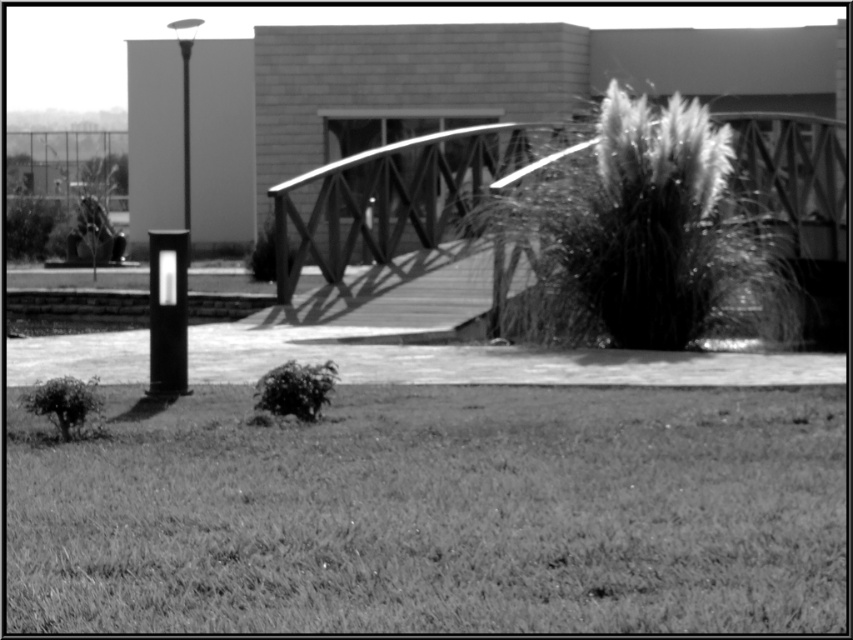
Question: Does wooden bridge at center come behind smooth black post at left?

Choices:
 (A) no
 (B) yes

Answer: (B)

Question: Which object is the farthest from the grassy lawn at lower center?

Choices:
 (A) smooth black post at left
 (B) wooden bridge at center
 (C) polished metal lamp post at left

Answer: (C)

Question: Among these objects, which one is farthest from the camera?

Choices:
 (A) wooden bridge at center
 (B) grassy lawn at lower center
 (C) polished metal lamp post at left
 (D) smooth black post at left

Answer: (C)

Question: Estimate the real-world distances between objects in this image. Which object is farther from the wooden bridge at center?

Choices:
 (A) smooth black post at left
 (B) grassy lawn at lower center
 (C) polished metal lamp post at left

Answer: (B)

Question: Observing the image, what is the correct spatial positioning of smooth black post at left in reference to polished metal lamp post at left?

Choices:
 (A) right
 (B) left

Answer: (A)

Question: Can you confirm if grassy lawn at lower center is bigger than wooden bridge at center?

Choices:
 (A) yes
 (B) no

Answer: (B)